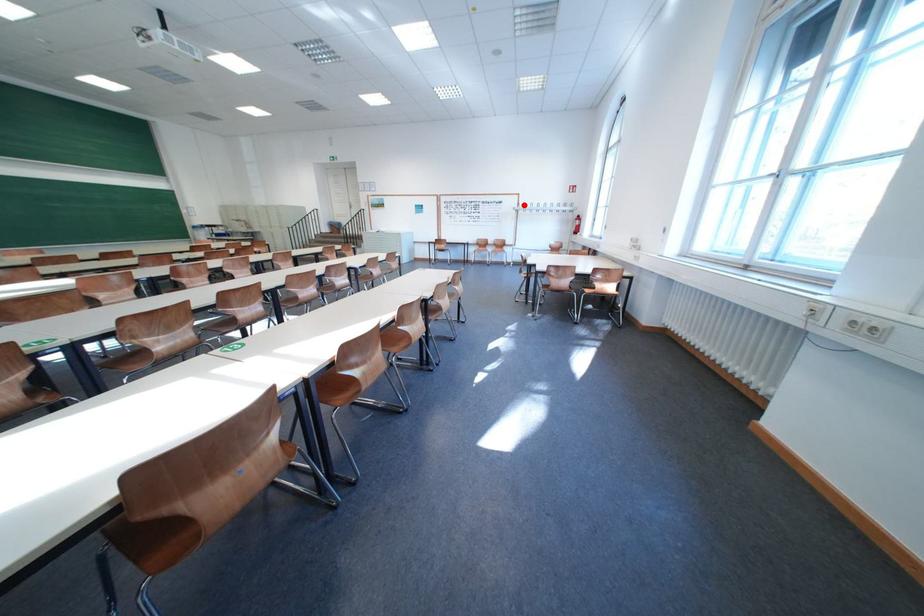
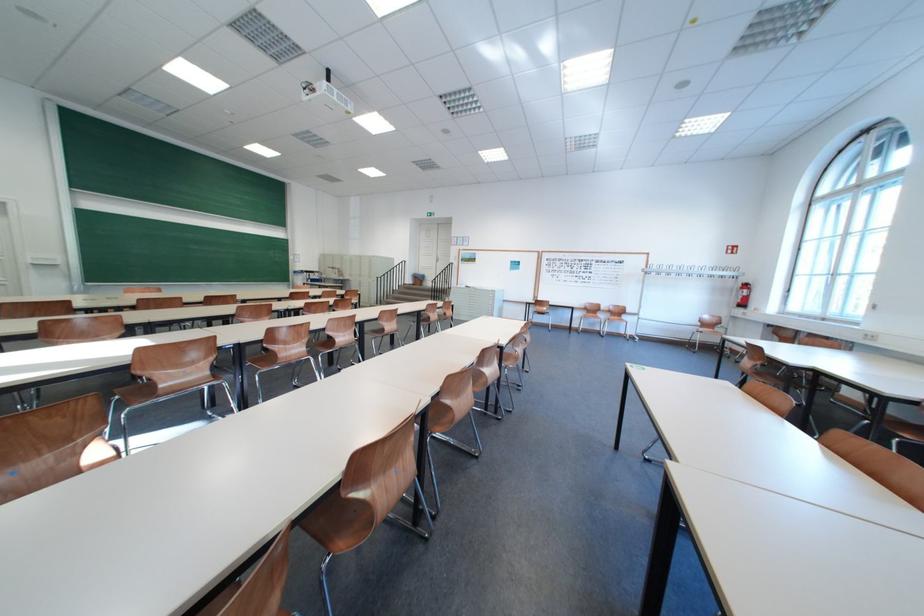
In the second image, find the point that corresponds to the highlighted location in the first image.

(649, 265)